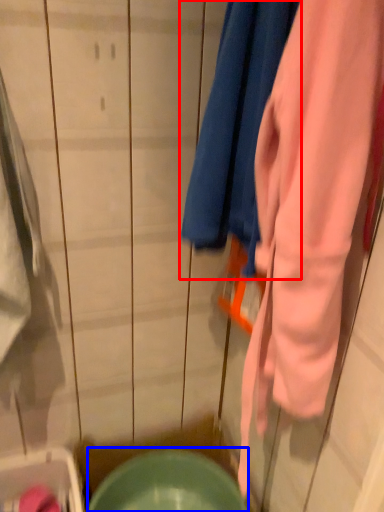
Question: Which of the following is the closest to the observer, towel (highlighted by a red box) or mixing bowl (highlighted by a blue box)?

Choices:
 (A) towel
 (B) mixing bowl

Answer: (A)